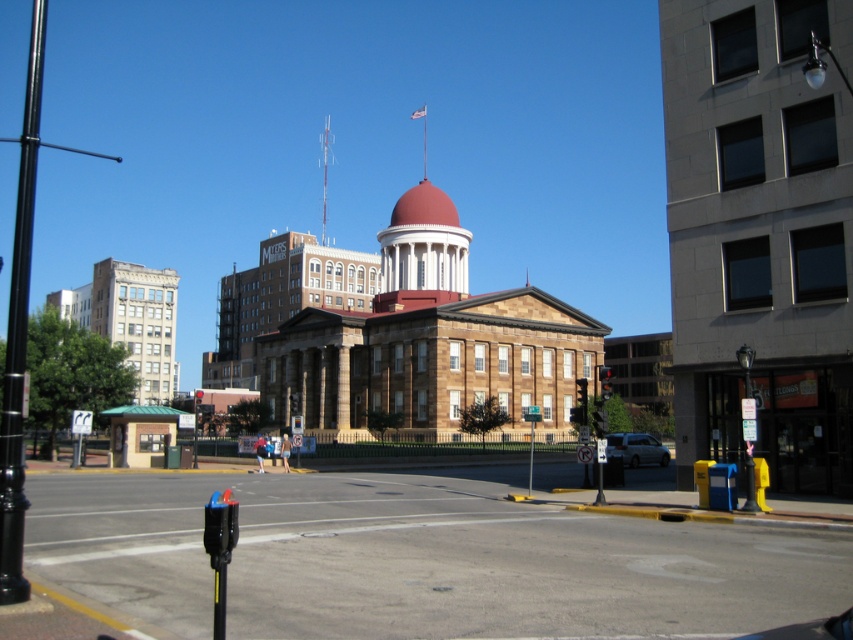
Does point (792, 586) come farther from viewer compared to point (26, 224)?

Yes, it is behind point (26, 224).

Can you confirm if metallic parking meter at lower left is positioned above black metal pole at left?

No.

Which is behind, point (688, 531) or point (33, 182)?

Point (688, 531)

Find the location of a particular element. This screenshot has width=853, height=640. metallic parking meter at lower left is located at coordinates (422, 560).

Is point (276, 550) closer to viewer compared to point (637, 438)?

That is True.

Can you confirm if metallic parking meter at lower left is wider than silver metallic van at lower right?

Yes, metallic parking meter at lower left is wider than silver metallic van at lower right.

I want to click on metallic parking meter at lower left, so click(422, 560).

Where is `metallic parking meter at lower left`? metallic parking meter at lower left is located at coordinates (422, 560).

Can you confirm if black metal pole at left is positioned to the left of silver metallic van at lower right?

Yes, black metal pole at left is to the left of silver metallic van at lower right.

Does black metal pole at left appear on the right side of silver metallic van at lower right?

Incorrect, black metal pole at left is not on the right side of silver metallic van at lower right.

You are a GUI agent. You are given a task and a screenshot of the screen. Output one action in this format:
    pyautogui.click(x=<x>, y=<y>)
    Task: Click on the black metal pole at left
    The height and width of the screenshot is (640, 853).
    Given the screenshot: What is the action you would take?
    pyautogui.click(x=19, y=332)